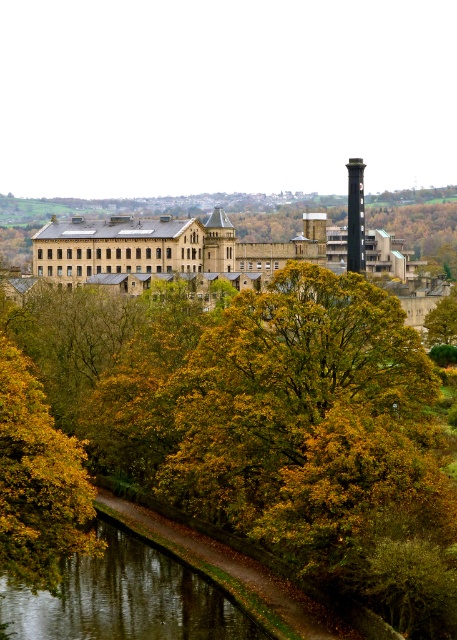
Can you confirm if yellow-green foliage at center is thinner than reflective smooth water at lower left?

Incorrect, yellow-green foliage at center's width is not less than reflective smooth water at lower left's.

Does point (226, 467) come farther from viewer compared to point (160, 627)?

Yes, point (226, 467) is behind point (160, 627).

Identify the location of yellow-green foliage at center. (244, 426).

Which is below, yellow-green foliage at center or smooth gray chimney at center?

yellow-green foliage at center is lower down.

How far apart are yellow-green foliage at center and smooth gray chimney at center?

A distance of 60.91 meters exists between yellow-green foliage at center and smooth gray chimney at center.

The width and height of the screenshot is (457, 640). Describe the element at coordinates (244, 426) in the screenshot. I see `yellow-green foliage at center` at that location.

Locate an element on the screen. The width and height of the screenshot is (457, 640). yellow-green foliage at center is located at coordinates (244, 426).

Which of these two, reflective smooth water at lower left or smooth gray chimney at center, stands taller?

smooth gray chimney at center

Locate an element on the screen. The image size is (457, 640). reflective smooth water at lower left is located at coordinates pos(123,598).

Where is `reflective smooth water at lower left`? Image resolution: width=457 pixels, height=640 pixels. reflective smooth water at lower left is located at coordinates (123, 598).